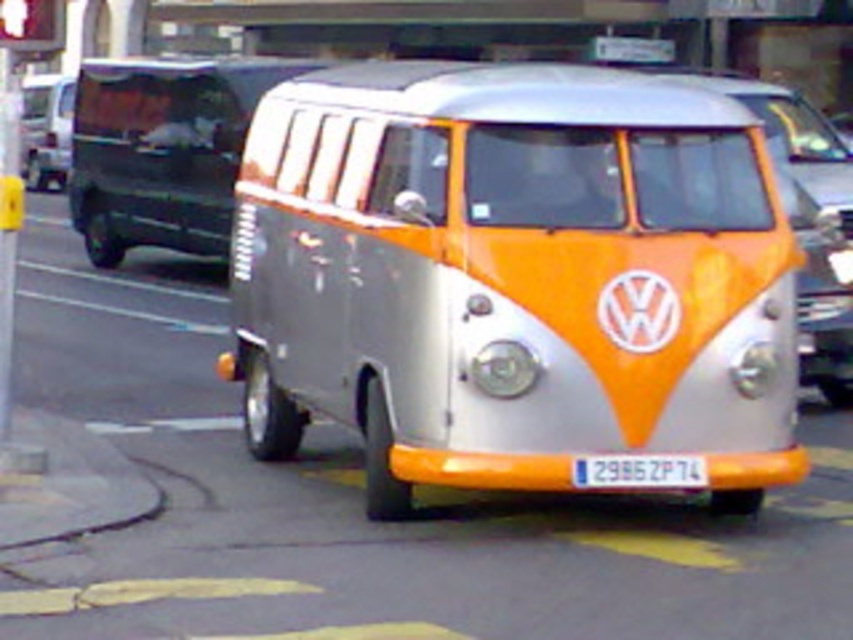
Does point (804, 304) lie in front of point (573, 477)?

No, it is not.

Is metallic silver van at center positioned in front of white plastic license plate at center?

No, it is behind white plastic license plate at center.

You are a GUI agent. You are given a task and a screenshot of the screen. Output one action in this format:
    pyautogui.click(x=<x>, y=<y>)
    Task: Click on the metallic silver van at center
    
    Given the screenshot: What is the action you would take?
    pyautogui.click(x=808, y=221)

Locate an element on the screen. The image size is (853, 640). metallic silver van at center is located at coordinates (808, 221).

Does silver metallic van at center appear on the left side of metallic silver van at center?

Yes, silver metallic van at center is to the left of metallic silver van at center.

Between silver metallic van at center and metallic silver van at center, which one appears on the right side from the viewer's perspective?

From the viewer's perspective, metallic silver van at center appears more on the right side.

At what (x,y) coordinates should I click in order to perform the action: click on silver metallic van at center. Please return your answer as a coordinate pair (x, y). Looking at the image, I should click on (514, 276).

Between silver metallic van at center and white plastic license plate at center, which one appears on the right side from the viewer's perspective?

Positioned to the right is white plastic license plate at center.

Is point (767, 424) positioned before point (584, 467)?

No, (767, 424) is behind (584, 467).

The height and width of the screenshot is (640, 853). In order to click on silver metallic van at center in this screenshot , I will do tap(514, 276).